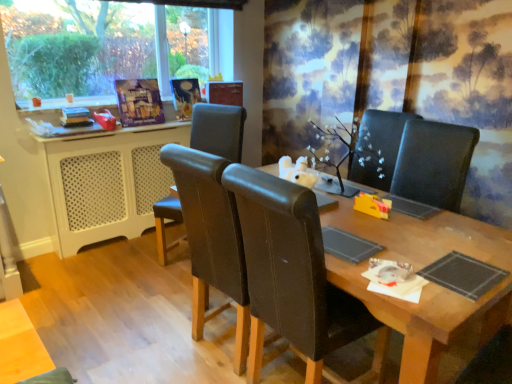
Question: Which direction should I rotate to face leather at center, arranged as the 2th chair when viewed from the right, — up or down?

Choices:
 (A) down
 (B) up

Answer: (B)

Question: Considering the relative positions of brown leather chair at center, which appears as the 2th chair when viewed from the left, and wooden table at center in the image provided, is brown leather chair at center, which appears as the 2th chair when viewed from the left, to the left of wooden table at center from the viewer's perspective?

Choices:
 (A) no
 (B) yes

Answer: (B)

Question: From a real-world perspective, is brown leather chair at center, the 2th chair from the back, positioned under wooden table at center based on gravity?

Choices:
 (A) yes
 (B) no

Answer: (B)

Question: Is brown leather chair at center, the 2th chair from the back, not close to wooden table at center?

Choices:
 (A) yes
 (B) no

Answer: (B)

Question: Is brown leather chair at center, positioned as the 1th chair in right-to-left order, with wooden table at center?

Choices:
 (A) yes
 (B) no

Answer: (B)

Question: Is brown leather chair at center, the 2th chair from the back, wider than wooden table at center?

Choices:
 (A) no
 (B) yes

Answer: (A)

Question: From the image's perspective, is brown leather chair at center, positioned as the 1th chair in right-to-left order, beneath wooden table at center?

Choices:
 (A) yes
 (B) no

Answer: (B)

Question: From a real-world perspective, does wooden table at center sit lower than white perforated plastic at left?

Choices:
 (A) no
 (B) yes

Answer: (B)

Question: Does wooden table at center have a greater width compared to white perforated plastic at left?

Choices:
 (A) yes
 (B) no

Answer: (A)

Question: Is wooden table at center further to camera compared to white perforated plastic at left?

Choices:
 (A) yes
 (B) no

Answer: (B)

Question: Considering the relative positions of wooden table at center and white perforated plastic at left in the image provided, is wooden table at center in front of white perforated plastic at left?

Choices:
 (A) yes
 (B) no

Answer: (A)

Question: Does wooden table at center have a greater height compared to white perforated plastic at left?

Choices:
 (A) no
 (B) yes

Answer: (A)

Question: Considering the relative sizes of wooden table at center and white perforated plastic at left in the image provided, is wooden table at center thinner than white perforated plastic at left?

Choices:
 (A) no
 (B) yes

Answer: (A)

Question: Is leather at center, placed as the first chair when sorted from left to right, next to wooden table at center and touching it?

Choices:
 (A) no
 (B) yes

Answer: (A)